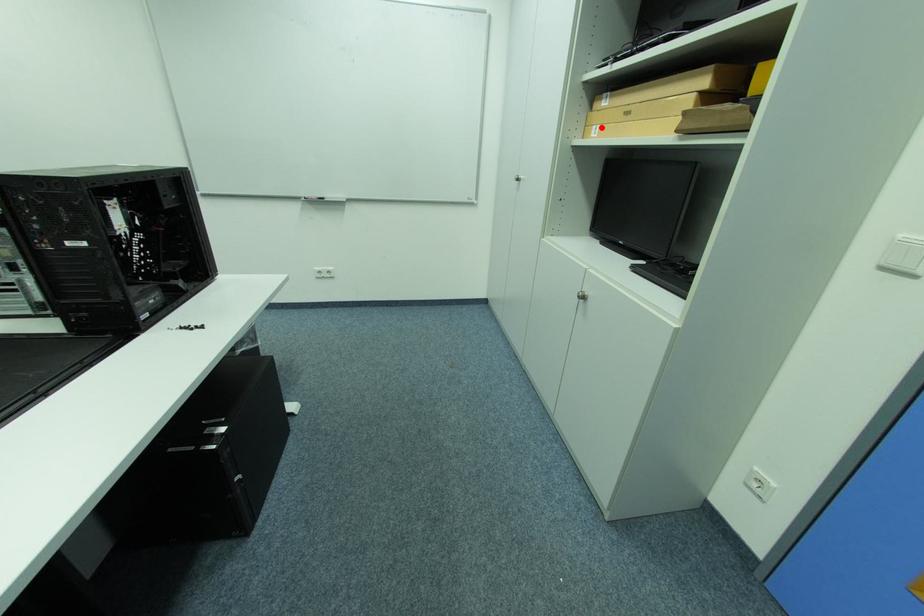
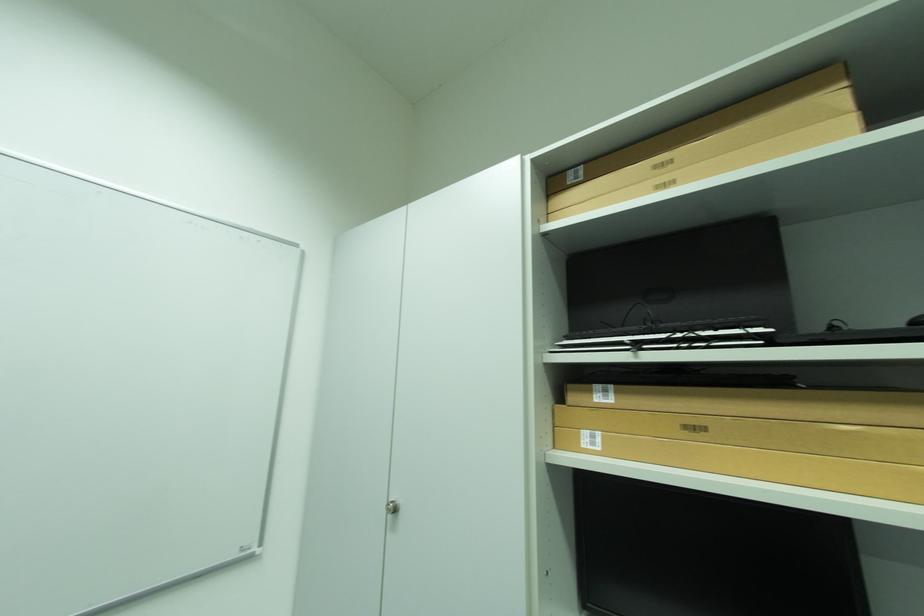
Question: I am providing you with two images of the same scene from different viewpoints. In image1, a red point is highlighted. Considering the same 3D point in image2, which of the following is correct?

Choices:
 (A) It is closer
 (B) It is farther

Answer: (B)